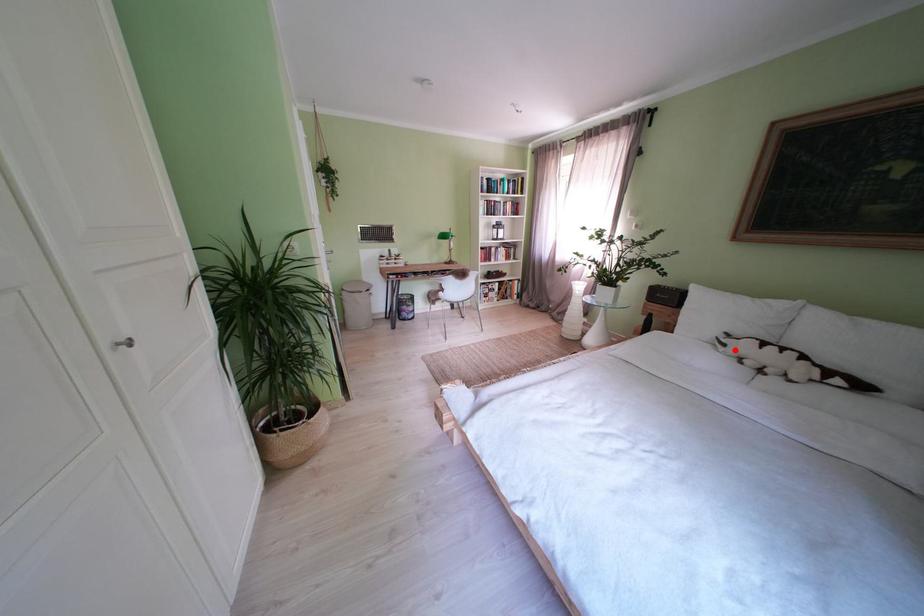
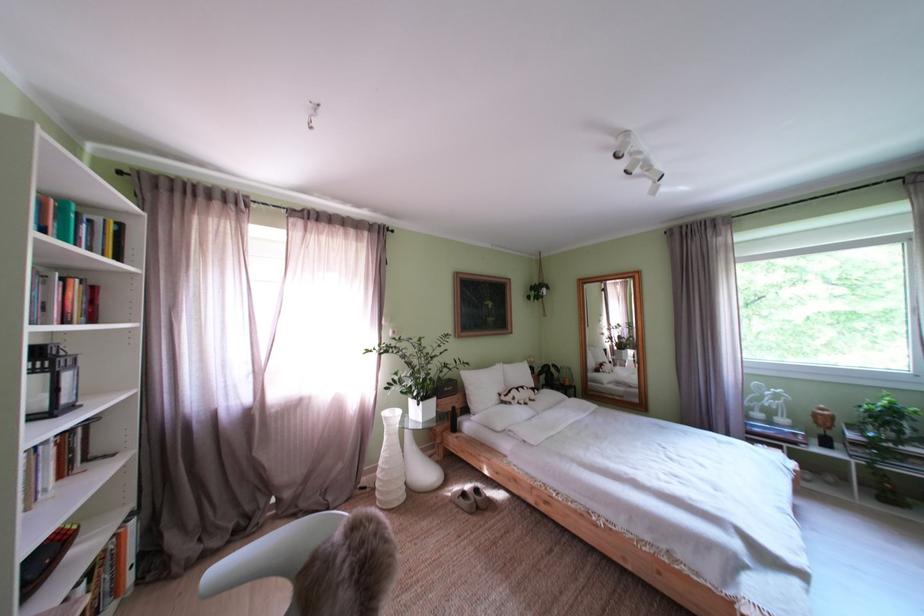
Find the pixel in the second image that matches the highlighted location in the first image.

(525, 405)